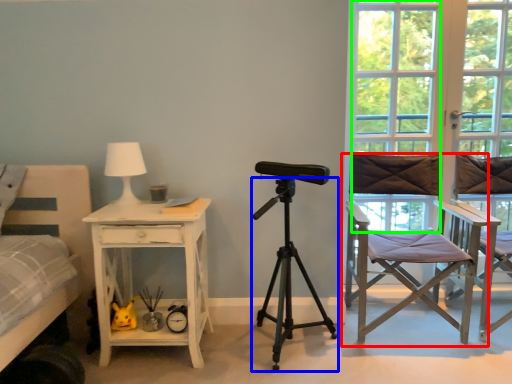
Question: Which object is the closest to the chair (highlighted by a red box)? Choose among these: tripod (highlighted by a blue box) or window (highlighted by a green box).

Choices:
 (A) tripod
 (B) window

Answer: (A)